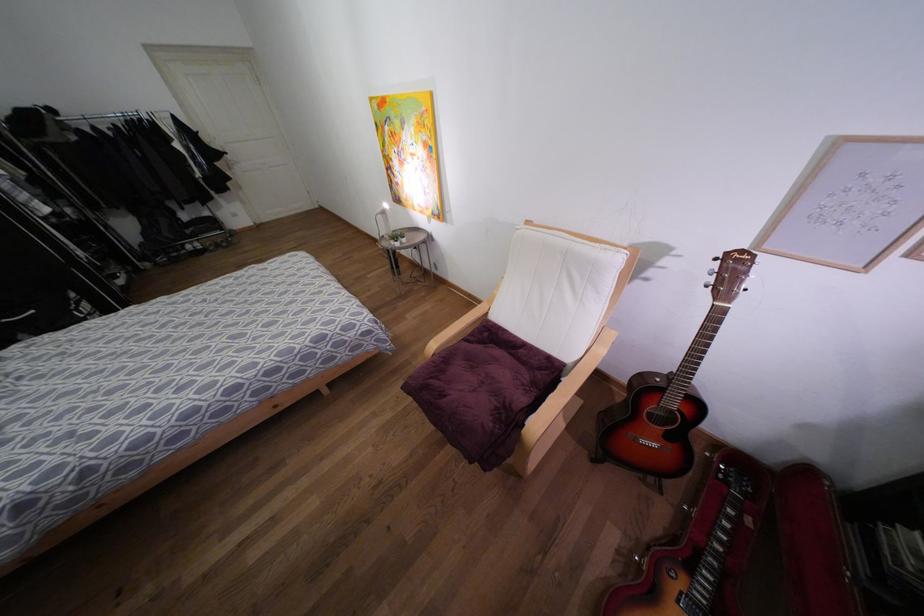
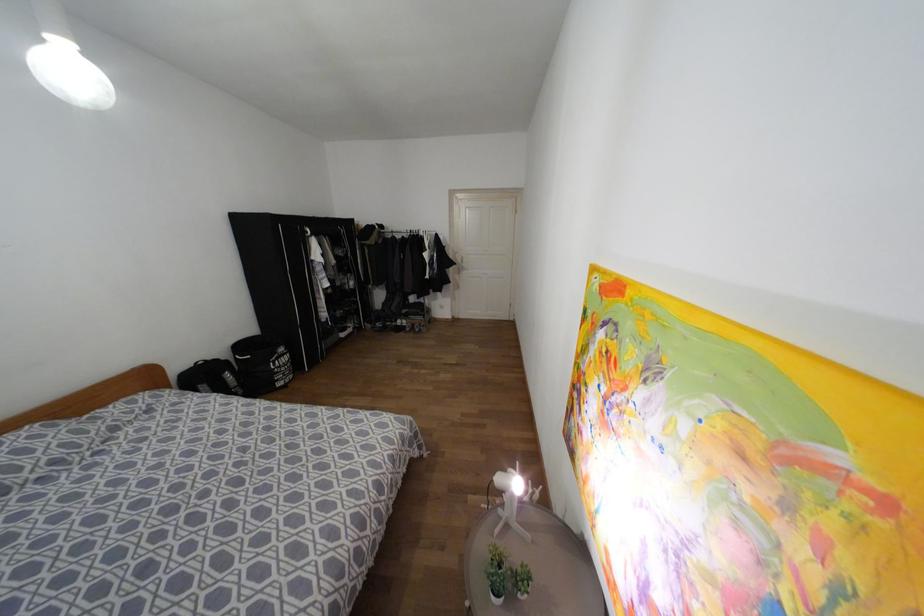
Find the pixel in the second image that matches the point at 144,116 in the first image.

(419, 233)